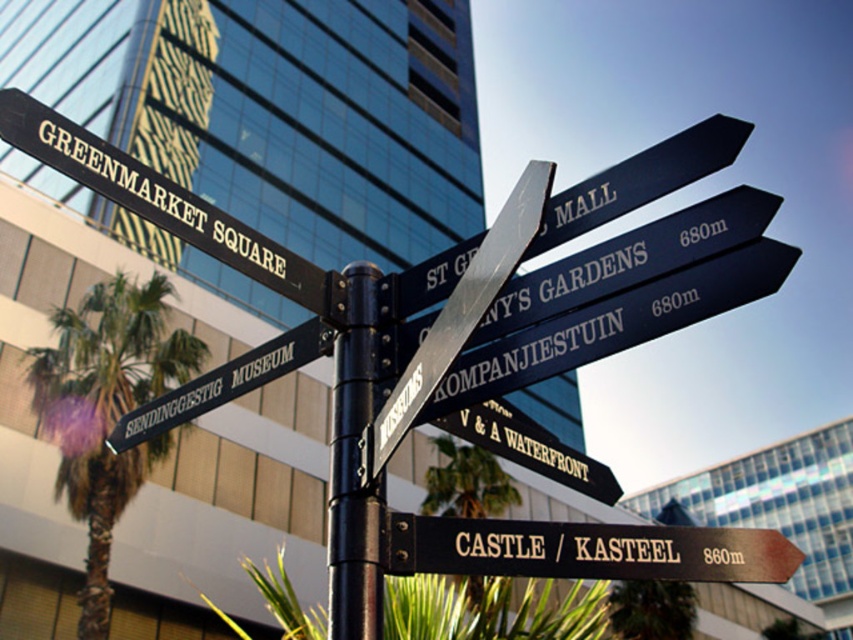
Question: Is green leafy palm tree at left further to camera compared to brown wooden sign at lower right?

Choices:
 (A) yes
 (B) no

Answer: (A)

Question: Is the position of brown wooden sign at lower right more distant than that of black metal pole at center?

Choices:
 (A) no
 (B) yes

Answer: (A)

Question: Among these points, which one is nearest to the camera?

Choices:
 (A) (97, 436)
 (B) (346, 493)
 (C) (485, 520)

Answer: (B)

Question: Which of the following is the farthest from the observer?

Choices:
 (A) (119, 275)
 (B) (598, 545)
 (C) (345, 579)

Answer: (A)

Question: Which point is farther from the camera taking this photo?

Choices:
 (A) (166, 348)
 (B) (480, 532)
 (C) (357, 387)

Answer: (A)

Question: Where is brown wooden sign at lower right located in relation to black metal pole at center in the image?

Choices:
 (A) right
 (B) left

Answer: (A)